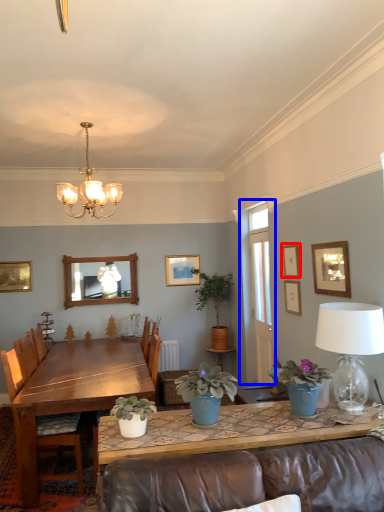
Question: Which object appears closest to the camera in this image, picture frame (highlighted by a red box) or window (highlighted by a blue box)?

Choices:
 (A) picture frame
 (B) window

Answer: (A)